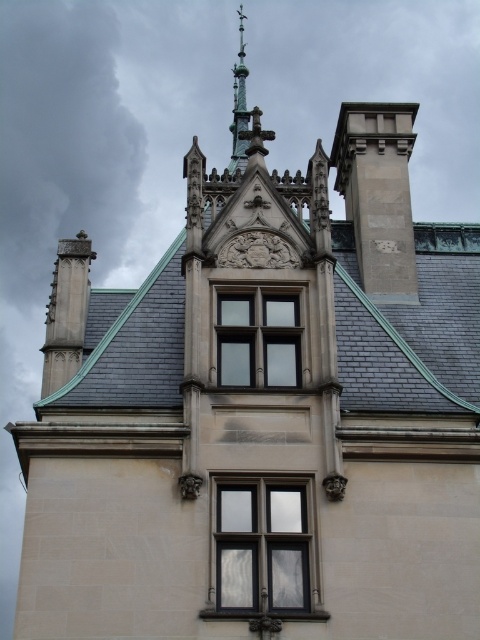
You are an architect assessing the symmetry of the building. You notice the clear glass window at center and the gray slate roof at center. Which of these two elements has a smaller width?

The clear glass window at center has a smaller width than the gray slate roof at center according to the description provided.

You are standing in front of the grand historic building and notice two points marked on the facade. The first point is at coordinates point (242, 307) and the second is at point (94, 358). Which of these points is closer to you?

Point (242, 307) is further to the viewer than point (94, 358), so the point closer to you is point (94, 358).